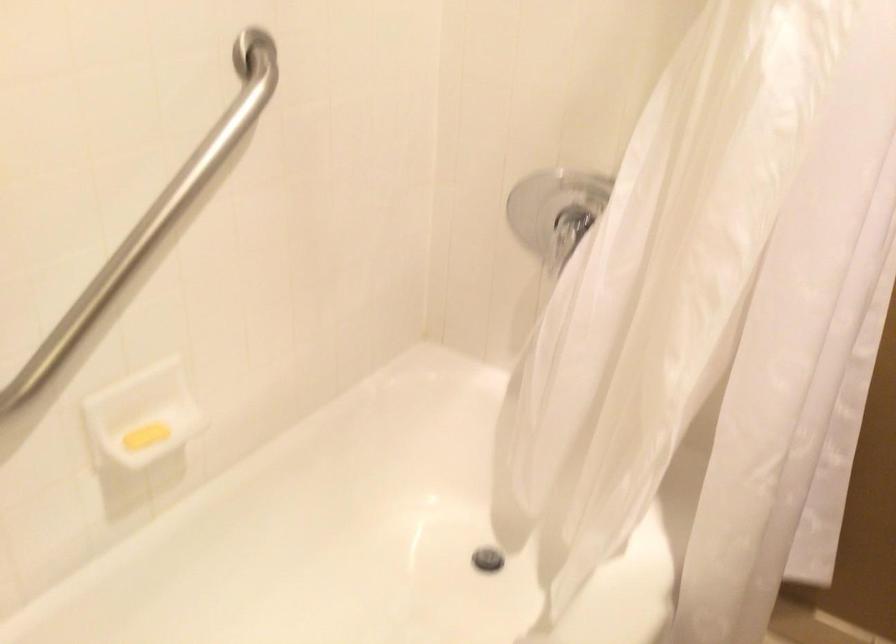
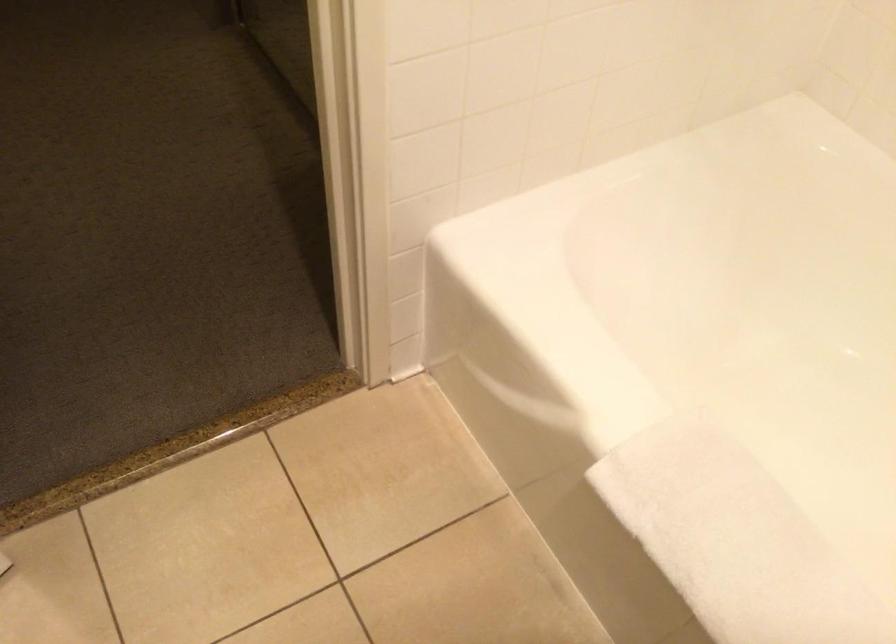
The images are taken continuously from a first-person perspective. In which direction is your viewpoint rotating?

The rotation direction of the camera is left-down.